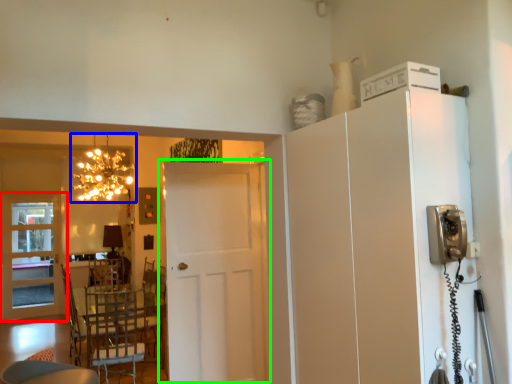
Question: Considering the real-world distances, which object is farthest from door (highlighted by a red box)? lamp (highlighted by a blue box) or door (highlighted by a green box)?

Choices:
 (A) lamp
 (B) door

Answer: (B)